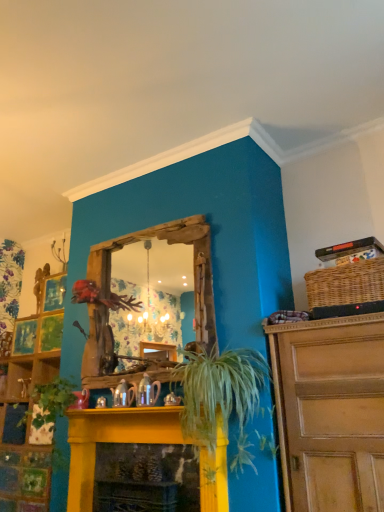
Image resolution: width=384 pixels, height=512 pixels. What are the coordinates of `green matte plant at lower left` in the screenshot? It's located at (53, 412).

Measure the distance between green leafy plant at center and camera.

green leafy plant at center is 7.93 feet away from camera.

Where is `woven brown basket at upper right`? The image size is (384, 512). woven brown basket at upper right is located at coordinates (346, 284).

Consider the image. Which object is positioned more to the right, green leafy plant at center or yellow painted wood fireplace at center?

green leafy plant at center is more to the right.

Can you confirm if green leafy plant at center is shorter than yellow painted wood fireplace at center?

No.

Does green leafy plant at center turn towards yellow painted wood fireplace at center?

No, green leafy plant at center is not facing towards yellow painted wood fireplace at center.

Considering the sizes of green matte plant at lower left and yellow painted wood fireplace at center in the image, is green matte plant at lower left wider or thinner than yellow painted wood fireplace at center?

Clearly, green matte plant at lower left has more width compared to yellow painted wood fireplace at center.

Is green matte plant at lower left aimed at yellow painted wood fireplace at center?

No, green matte plant at lower left does not turn towards yellow painted wood fireplace at center.

I want to click on fireplace on the right of green matte plant at lower left, so click(x=113, y=441).

From the picture: Considering their positions, is green matte plant at lower left located in front of or behind green leafy plant at center?

green matte plant at lower left is behind green leafy plant at center.

Is green matte plant at lower left next to green leafy plant at center?

No, green matte plant at lower left is not next to green leafy plant at center.

Is green matte plant at lower left looking in the opposite direction of green leafy plant at center?

No, green leafy plant at center is not at the back of green matte plant at lower left.

From a real-world perspective, is green matte plant at lower left positioned over green leafy plant at center based on gravity?

No.

Looking at their sizes, would you say yellow painted wood fireplace at center is wider or thinner than woven brown basket at upper right?

Considering their sizes, yellow painted wood fireplace at center looks slimmer than woven brown basket at upper right.

Considering the relative sizes of yellow painted wood fireplace at center and woven brown basket at upper right in the image provided, is yellow painted wood fireplace at center bigger than woven brown basket at upper right?

Yes, yellow painted wood fireplace at center is bigger than woven brown basket at upper right.

Is woven brown basket at upper right located within yellow painted wood fireplace at center?

That's incorrect, woven brown basket at upper right is not inside yellow painted wood fireplace at center.

Does point (74, 418) come farther from viewer compared to point (346, 302)?

Yes.

In the scene shown: Is green leafy plant at center touching woven brown basket at upper right?

No, green leafy plant at center is not with woven brown basket at upper right.

Visually, is green leafy plant at center positioned to the left or to the right of woven brown basket at upper right?

From the image, it's evident that green leafy plant at center is to the left of woven brown basket at upper right.

Is green leafy plant at center in front of woven brown basket at upper right?

Yes.

Consider the image. Is woven brown basket at upper right located within green leafy plant at center?

No, woven brown basket at upper right is not surrounded by green leafy plant at center.

Which of these two, woven brown basket at upper right or green matte plant at lower left, is wider?

Wider between the two is green matte plant at lower left.

From the picture: Is woven brown basket at upper right oriented away from green matte plant at lower left?

No, woven brown basket at upper right's orientation is not away from green matte plant at lower left.

From a real-world perspective, is woven brown basket at upper right positioned above or below green matte plant at lower left?

From a real-world perspective, woven brown basket at upper right is physically above green matte plant at lower left.

Is green leafy plant at center next to green matte plant at lower left?

There is a gap between green leafy plant at center and green matte plant at lower left.

Consider the image. Considering the positions of objects green leafy plant at center and green matte plant at lower left in the image provided, who is more to the left, green leafy plant at center or green matte plant at lower left?

From the viewer's perspective, green matte plant at lower left appears more on the left side.

Is green leafy plant at center looking in the opposite direction of green matte plant at lower left?

No, green leafy plant at center is not facing the opposite direction of green matte plant at lower left.

In the scene shown: Who is shorter, green leafy plant at center or green matte plant at lower left?

With less height is green matte plant at lower left.

Image resolution: width=384 pixels, height=512 pixels. In order to click on fireplace behind the green leafy plant at center in this screenshot , I will do `click(113, 441)`.

Where is `fireplace directly beneath the green matte plant at lower left (from a real-world perspective)`? Image resolution: width=384 pixels, height=512 pixels. fireplace directly beneath the green matte plant at lower left (from a real-world perspective) is located at coordinates (113, 441).

Looking at the image, which one is located closer to woven brown basket at upper right, green leafy plant at center or yellow painted wood fireplace at center?

green leafy plant at center is positioned closer to the anchor woven brown basket at upper right.

Which object lies further to the anchor point green leafy plant at center, woven brown basket at upper right or green matte plant at lower left?

green matte plant at lower left is further to green leafy plant at center.

From the image, which object appears to be nearer to yellow painted wood fireplace at center, green leafy plant at center or woven brown basket at upper right?

Based on the image, green leafy plant at center appears to be nearer to yellow painted wood fireplace at center.

Based on their spatial positions, is green matte plant at lower left or green leafy plant at center further from yellow painted wood fireplace at center?

green leafy plant at center is positioned further to the anchor yellow painted wood fireplace at center.

Consider the image. When comparing their distances from woven brown basket at upper right, does yellow painted wood fireplace at center or green matte plant at lower left seem further?

green matte plant at lower left.

Estimate the real-world distances between objects in this image. Which object is closer to green leafy plant at center, green matte plant at lower left or yellow painted wood fireplace at center?

yellow painted wood fireplace at center is positioned closer to the anchor green leafy plant at center.

Looking at the image, which one is located further to green matte plant at lower left, woven brown basket at upper right or yellow painted wood fireplace at center?

woven brown basket at upper right lies further to green matte plant at lower left than the other object.

When comparing their distances from green leafy plant at center, does woven brown basket at upper right or yellow painted wood fireplace at center seem further?

Based on the image, woven brown basket at upper right appears to be further to green leafy plant at center.

Where is `fireplace located between green matte plant at lower left and green leafy plant at center in the left-right direction`? fireplace located between green matte plant at lower left and green leafy plant at center in the left-right direction is located at coordinates (113, 441).

Where is `fireplace between green matte plant at lower left and woven brown basket at upper right from left to right`? This screenshot has width=384, height=512. fireplace between green matte plant at lower left and woven brown basket at upper right from left to right is located at coordinates (113, 441).

Identify the location of houseplant between green matte plant at lower left and woven brown basket at upper right in the horizontal direction. (220, 395).

Identify the location of houseplant between yellow painted wood fireplace at center and woven brown basket at upper right from left to right. (220, 395).